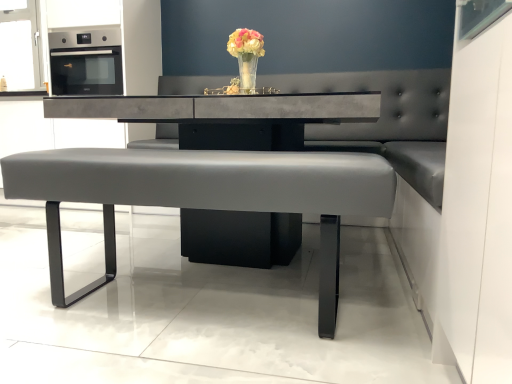
Question: Should I look upward or downward to see concrete table at center?

Choices:
 (A) down
 (B) up

Answer: (B)

Question: From the image's perspective, is matte gray bench at center located above translucent glass vase at center?

Choices:
 (A) no
 (B) yes

Answer: (A)

Question: Is matte gray bench at center at the right side of translucent glass vase at center?

Choices:
 (A) no
 (B) yes

Answer: (A)

Question: Can you confirm if matte gray bench at center is bigger than translucent glass vase at center?

Choices:
 (A) yes
 (B) no

Answer: (A)

Question: Is matte gray bench at center not within translucent glass vase at center?

Choices:
 (A) yes
 (B) no

Answer: (A)

Question: Could you tell me if matte gray bench at center is turned towards translucent glass vase at center?

Choices:
 (A) no
 (B) yes

Answer: (A)

Question: From a real-world perspective, is matte gray bench at center located higher than translucent glass vase at center?

Choices:
 (A) yes
 (B) no

Answer: (B)

Question: Is matte gray bench at center oriented away from satin black oven at upper left?

Choices:
 (A) no
 (B) yes

Answer: (A)

Question: Is matte gray bench at center shorter than satin black oven at upper left?

Choices:
 (A) no
 (B) yes

Answer: (A)

Question: Is matte gray bench at center thinner than satin black oven at upper left?

Choices:
 (A) yes
 (B) no

Answer: (A)

Question: From a real-world perspective, is matte gray bench at center over satin black oven at upper left?

Choices:
 (A) yes
 (B) no

Answer: (B)

Question: Is matte gray bench at center not close to satin black oven at upper left?

Choices:
 (A) yes
 (B) no

Answer: (A)

Question: Is matte gray bench at center facing towards satin black oven at upper left?

Choices:
 (A) no
 (B) yes

Answer: (A)

Question: From the image's perspective, would you say satin black oven at upper left is positioned over concrete table at center?

Choices:
 (A) yes
 (B) no

Answer: (A)